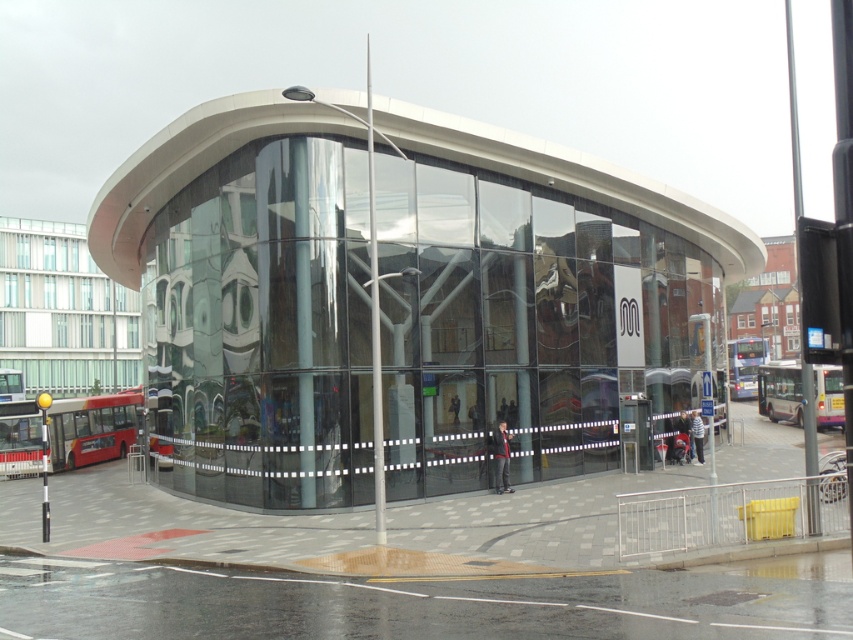
Between transparent glass bus station at center and white metallic bus at right, which one is positioned lower?

white metallic bus at right

Is transparent glass bus station at center bigger than white metallic bus at right?

No, transparent glass bus station at center is not bigger than white metallic bus at right.

Which is in front, point (247, 436) or point (836, 413)?

Point (247, 436) is in front.

Locate an element on the screen. transparent glass bus station at center is located at coordinates (526, 296).

Does point (10, 445) come behind point (840, 420)?

No.

What do you see at coordinates (91, 428) in the screenshot?
I see `red metallic bus at lower left` at bounding box center [91, 428].

Is point (22, 467) in front of point (828, 384)?

Yes, point (22, 467) is in front of point (828, 384).

At what (x,y) coordinates should I click in order to perform the action: click on red metallic bus at lower left. Please return your answer as a coordinate pair (x, y). This screenshot has height=640, width=853. Looking at the image, I should click on (91, 428).

Who is higher up, red metallic bus at lower left or blue metallic bus at center?

blue metallic bus at center

Is point (64, 461) more distant than point (753, 337)?

No.

Identify the location of red metallic bus at lower left. (91, 428).

Locate an element on the screen. red metallic bus at lower left is located at coordinates (91, 428).